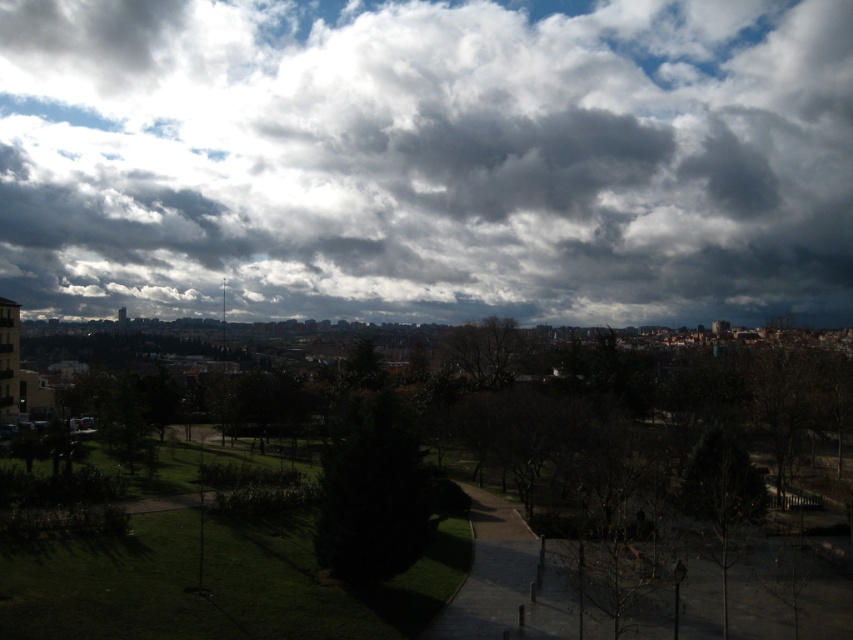
You are a city planner analyzing the urban park layout. You notice the green leafy tree at center and the bare branches at lower right. Which of these two has a bigger canopy size?

The green leafy tree at center has a larger canopy size than the bare branches at lower right, as it is described to be larger in size.

You are standing in the park and want to take a photo of the green leafy tree at center with the cloudy sky at upper center in the background. Given that the camera can focus on objects up to 200 meters away, will both the tree and the sky be in focus?

The cloudy sky at upper center is 219.10 meters away from the green leafy tree at center. Since the camera can only focus up to 200 meters, the sky will be out of focus while the tree is within range.

You are standing in the park and looking at the cloudy sky at upper center and the green leafy tree at center. Which object is positioned to the left when viewed from your perspective?

The cloudy sky at upper center is positioned to the left of the green leafy tree at center.